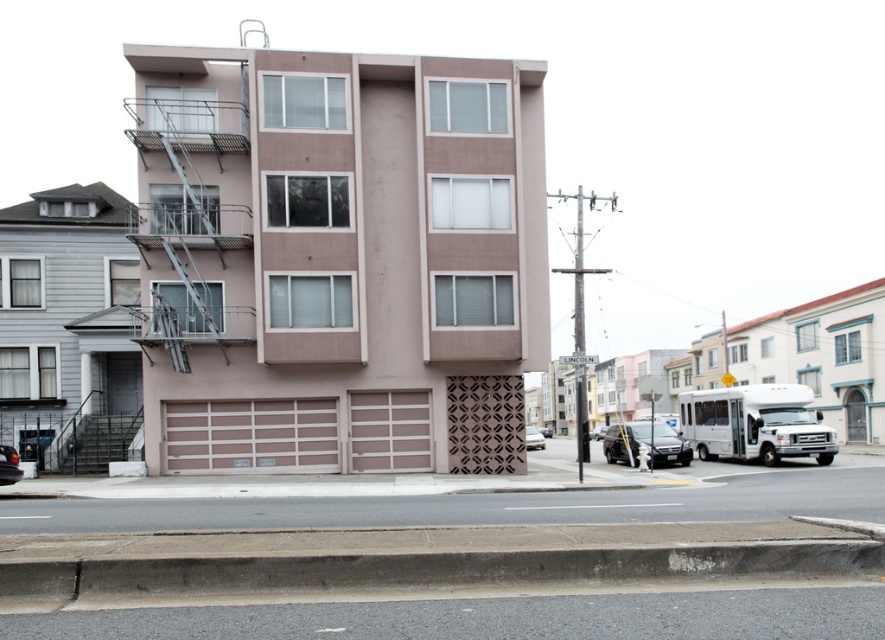
This screenshot has width=885, height=640. Describe the element at coordinates (419, 570) in the screenshot. I see `concrete at lower center` at that location.

What do you see at coordinates (419, 570) in the screenshot?
I see `concrete at lower center` at bounding box center [419, 570].

You are a GUI agent. You are given a task and a screenshot of the screen. Output one action in this format:
    pyautogui.click(x=<x>, y=<y>)
    Task: Click on the concrete at lower center
    The image size is (885, 640).
    Given the screenshot: What is the action you would take?
    pyautogui.click(x=419, y=570)

Does metallic silver fire escape at left appear on the left side of silver metallic sedan at center?

Correct, you'll find metallic silver fire escape at left to the left of silver metallic sedan at center.

Does metallic silver fire escape at left come behind silver metallic sedan at center?

No, it is in front of silver metallic sedan at center.

What do you see at coordinates (189, 218) in the screenshot? I see `metallic silver fire escape at left` at bounding box center [189, 218].

The height and width of the screenshot is (640, 885). Find the location of `metallic silver fire escape at left`. metallic silver fire escape at left is located at coordinates (189, 218).

Does concrete at lower center appear under matte black sedan at lower right?

Actually, concrete at lower center is above matte black sedan at lower right.

Locate an element on the screen. concrete at lower center is located at coordinates (419, 570).

In order to click on concrete at lower center in this screenshot , I will do `click(419, 570)`.